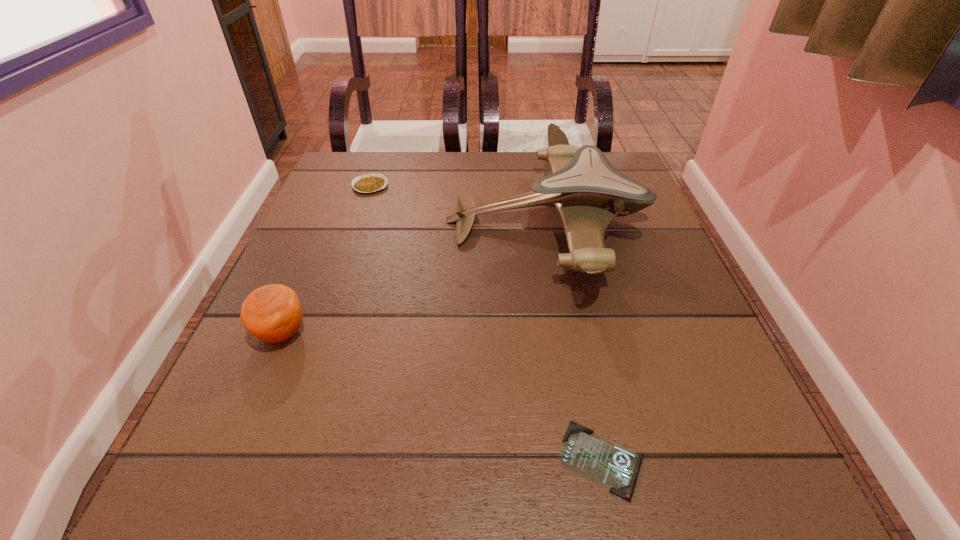
Image resolution: width=960 pixels, height=540 pixels. In the image, there is a desktop. In order to click on vacant space at the left edge in this screenshot , I will do `click(360, 289)`.

Where is `vacant space at the right edge`? vacant space at the right edge is located at coordinates (651, 244).

At what (x,y) coordinates should I click in order to perform the action: click on vacant space at the far left corner of the desktop. Please return your answer as a coordinate pair (x, y). The height and width of the screenshot is (540, 960). Looking at the image, I should click on (350, 197).

At what (x,y) coordinates should I click in order to perform the action: click on vacant space at the far right corner of the desktop. Please return your answer as a coordinate pair (x, y). Looking at the image, I should click on (632, 173).

Locate an element on the screen. blank space at the near right corner is located at coordinates (765, 482).

At what (x,y) coordinates should I click in order to perform the action: click on vacant area between the tallest object and the orange. Please return your answer as a coordinate pair (x, y). Looking at the image, I should click on (415, 277).

This screenshot has height=540, width=960. In order to click on vacant area that lies between the nearest object and the drone in this screenshot , I will do `click(574, 340)`.

Locate an element on the screen. This screenshot has width=960, height=540. vacant area between the nearest object and the drone is located at coordinates (574, 340).

I want to click on free space between the legume and the shortest object, so click(x=486, y=322).

At what (x,y) coordinates should I click in order to perform the action: click on vacant space in between the drone and the orange. Please return your answer as a coordinate pair (x, y). The height and width of the screenshot is (540, 960). Looking at the image, I should click on (415, 277).